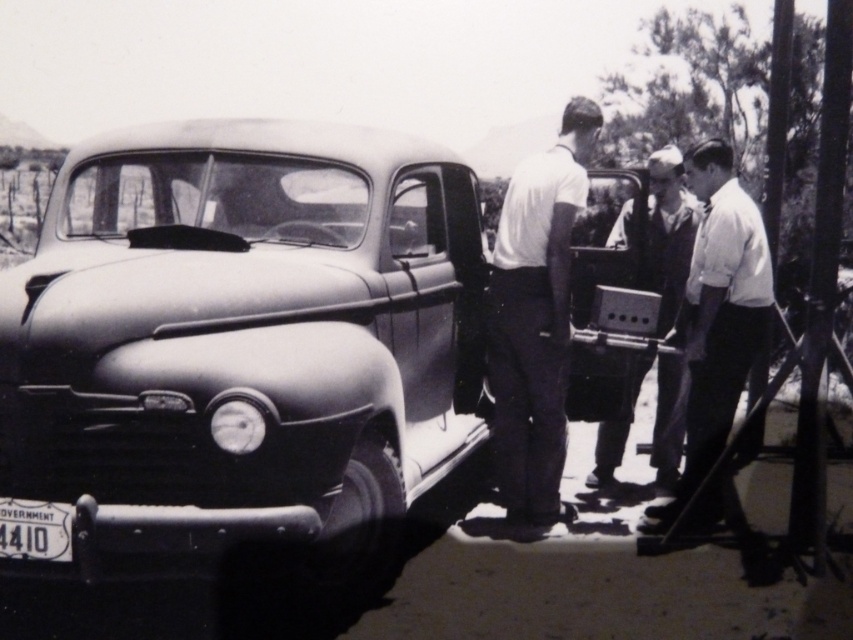
Which is more to the right, smooth white shirt at center or smooth fabric shirt at center?

smooth white shirt at center is more to the right.

Does point (718, 406) lie in front of point (642, 284)?

Yes, it is.

Identify the location of smooth white shirt at center. tap(718, 312).

Locate an element on the screen. This screenshot has height=640, width=853. smooth white shirt at center is located at coordinates (718, 312).

Does matte black car at center appear on the right side of white matte license plate at lower left?

Correct, you'll find matte black car at center to the right of white matte license plate at lower left.

Which is in front, point (395, 278) or point (33, 532)?

Positioned in front is point (33, 532).

Where is `matte black car at center`? matte black car at center is located at coordinates (244, 344).

Describe the element at coordinates (718, 312) in the screenshot. The height and width of the screenshot is (640, 853). I see `smooth white shirt at center` at that location.

Who is taller, smooth white shirt at center or white matte license plate at lower left?

smooth white shirt at center is taller.

Who is more distant from viewer, (708, 291) or (68, 531)?

The point (708, 291) is more distant.

Where is `smooth white shirt at center`? The height and width of the screenshot is (640, 853). smooth white shirt at center is located at coordinates (718, 312).